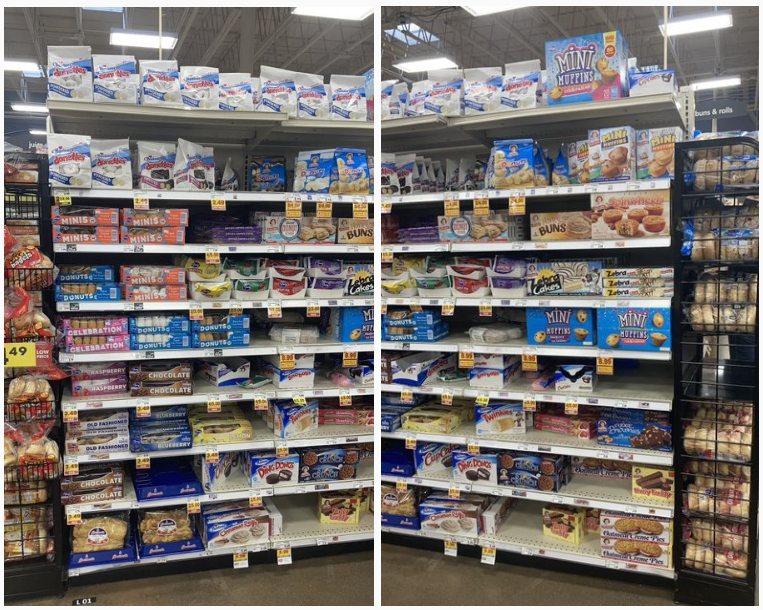
At what (x,y) coordinates should I click in order to perform the action: click on ceiling. Please return your answer as a coordinate pair (x, y). Looking at the image, I should click on (533, 24), (142, 7).